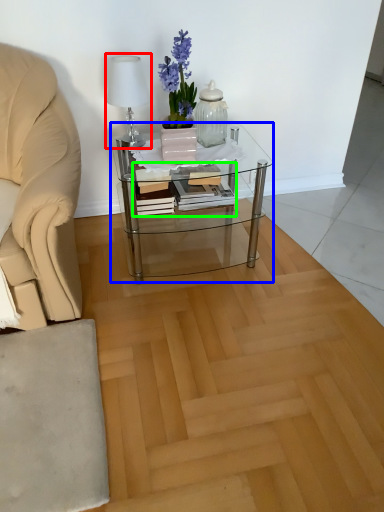
Question: Which object is the closest to the table lamp (highlighted by a red box)? Choose among these: coffee table (highlighted by a blue box) or book (highlighted by a green box).

Choices:
 (A) coffee table
 (B) book

Answer: (B)